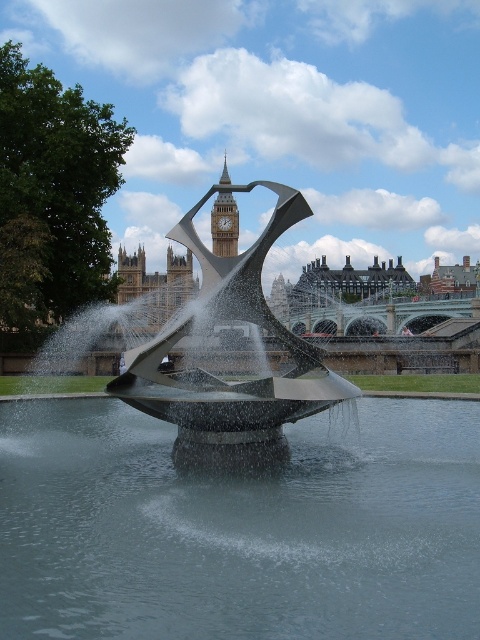
Question: Considering the real-world distances, which object is farthest from the polished stainless steel sculpture at center?

Choices:
 (A) polished stone clock tower at upper center
 (B) clear water at center

Answer: (A)

Question: Which is farther from the polished stone clock tower at upper center?

Choices:
 (A) clear water at center
 (B) polished stainless steel sculpture at center

Answer: (A)

Question: Which point appears closest to the camera in this image?

Choices:
 (A) (238, 404)
 (B) (7, 522)
 (C) (217, 237)

Answer: (B)

Question: From the image, what is the correct spatial relationship of clear water at center in relation to polished stainless steel sculpture at center?

Choices:
 (A) above
 (B) below

Answer: (B)

Question: Does clear water at center have a larger size compared to polished stainless steel sculpture at center?

Choices:
 (A) no
 (B) yes

Answer: (A)

Question: Where is clear water at center located in relation to polished stone clock tower at upper center in the image?

Choices:
 (A) right
 (B) left

Answer: (A)